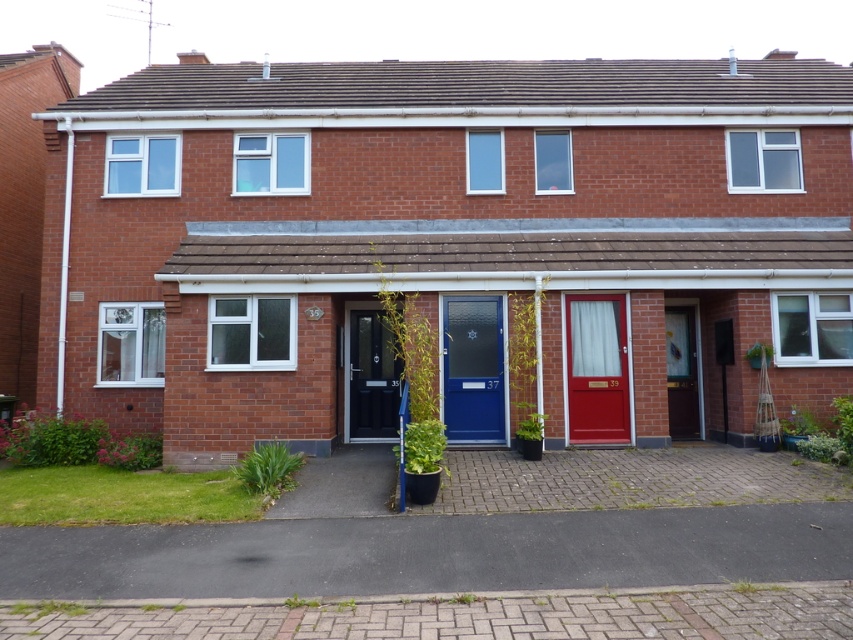
Can you confirm if matte red door at center is smaller than wooden door at center?

No.

Which is more to the left, matte red door at center or wooden door at center?

Positioned to the left is matte red door at center.

Describe the element at coordinates (596, 369) in the screenshot. I see `matte red door at center` at that location.

Image resolution: width=853 pixels, height=640 pixels. Find the location of `matte red door at center`. matte red door at center is located at coordinates [596, 369].

Is point (469, 324) farther from viewer compared to point (680, 385)?

No, it is not.

Is blue glossy door at center further to the viewer compared to wooden door at center?

No.

Does point (500, 358) come closer to viewer compared to point (674, 422)?

Yes, it is.

The height and width of the screenshot is (640, 853). Find the location of `blue glossy door at center`. blue glossy door at center is located at coordinates (473, 369).

Between point (450, 320) and point (361, 332), which one is positioned behind?

The point (361, 332) is behind.

Locate an element on the screen. blue glossy door at center is located at coordinates (473, 369).

Image resolution: width=853 pixels, height=640 pixels. I want to click on blue glossy door at center, so (x=473, y=369).